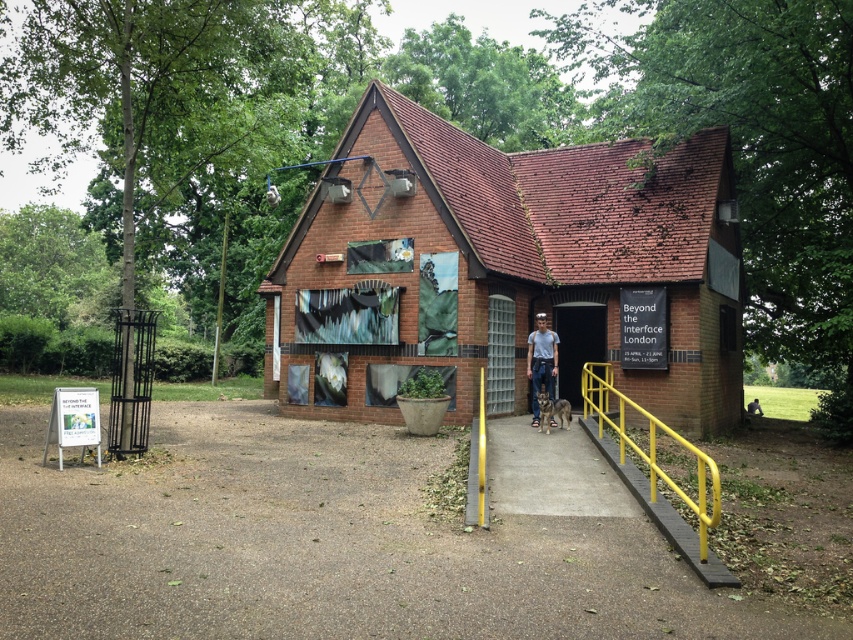
Does matte glass door at center have a lesser width compared to light blue denim jeans at center?

Incorrect, matte glass door at center's width is not less than light blue denim jeans at center's.

Is matte glass door at center above light blue denim jeans at center?

Correct, matte glass door at center is located above light blue denim jeans at center.

Is point (596, 355) more distant than point (538, 326)?

Yes, point (596, 355) is behind point (538, 326).

Locate an element on the screen. This screenshot has height=640, width=853. matte glass door at center is located at coordinates (577, 346).

Does yellow metal handrail at lower center have a lesser width compared to light blue denim jeans at center?

Incorrect, yellow metal handrail at lower center's width is not less than light blue denim jeans at center's.

Between point (602, 388) and point (527, 342), which one is positioned in front?

Positioned in front is point (602, 388).

This screenshot has width=853, height=640. Find the location of `yellow metal handrail at lower center`. yellow metal handrail at lower center is located at coordinates (650, 445).

Does brick building at center appear over light blue denim jeans at center?

Yes, brick building at center is above light blue denim jeans at center.

Is point (459, 385) behind point (529, 340)?

That is True.

Where is `brick building at center`? The image size is (853, 640). brick building at center is located at coordinates (503, 268).